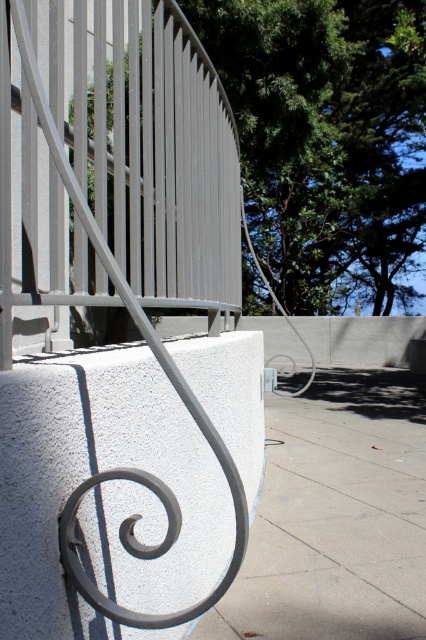
You are standing in front of the curved metal railing and looking at the decorative scrollwork. There are two points marked on the railing at coordinates point (89, 506) and point (247, 620). Which point is closer to you?

Point (89, 506) is in front of point (247, 620), so it is closer to you.

You are standing in front of the curved metal railing and want to locate the point at coordinates (103, 492). According to the scene description, what material will you find at that specific location?

The point at coordinates (103, 492) corresponds to white textured concrete at center, so you will find white textured concrete material there.

You are a construction worker inspecting the architectural design. You notice the white textured concrete at center and the gray concrete sidewalk at center. Which one is positioned higher in the structure?

The white textured concrete at center is located above the gray concrete sidewalk at center, so it is positioned higher in the structure.